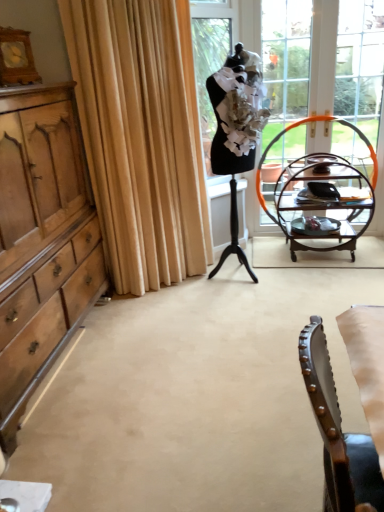
Question: From a real-world perspective, is clear glass window at upper right located beneath brown leather chair at lower right?

Choices:
 (A) no
 (B) yes

Answer: (A)

Question: Can you confirm if clear glass window at upper right is positioned to the left of brown leather chair at lower right?

Choices:
 (A) yes
 (B) no

Answer: (B)

Question: Can you confirm if clear glass window at upper right is wider than brown leather chair at lower right?

Choices:
 (A) no
 (B) yes

Answer: (A)

Question: Is clear glass window at upper right outside brown leather chair at lower right?

Choices:
 (A) yes
 (B) no

Answer: (A)

Question: Does clear glass window at upper right have a lesser width compared to brown leather chair at lower right?

Choices:
 (A) yes
 (B) no

Answer: (A)

Question: Is clear glass window at upper right to the right of brown leather chair at lower right from the viewer's perspective?

Choices:
 (A) yes
 (B) no

Answer: (A)

Question: Is beige fabric curtain at left bigger than clear glass window at upper right?

Choices:
 (A) yes
 (B) no

Answer: (A)

Question: From the image's perspective, is beige fabric curtain at left over clear glass window at upper right?

Choices:
 (A) yes
 (B) no

Answer: (B)

Question: Is beige fabric curtain at left outside clear glass window at upper right?

Choices:
 (A) yes
 (B) no

Answer: (A)

Question: Is beige fabric curtain at left with clear glass window at upper right?

Choices:
 (A) no
 (B) yes

Answer: (A)

Question: Does beige fabric curtain at left have a lesser width compared to clear glass window at upper right?

Choices:
 (A) yes
 (B) no

Answer: (B)

Question: Is beige fabric curtain at left further to camera compared to clear glass window at upper right?

Choices:
 (A) yes
 (B) no

Answer: (B)

Question: Does beige fabric curtain at left have a lesser width compared to wooden desk at right?

Choices:
 (A) yes
 (B) no

Answer: (A)